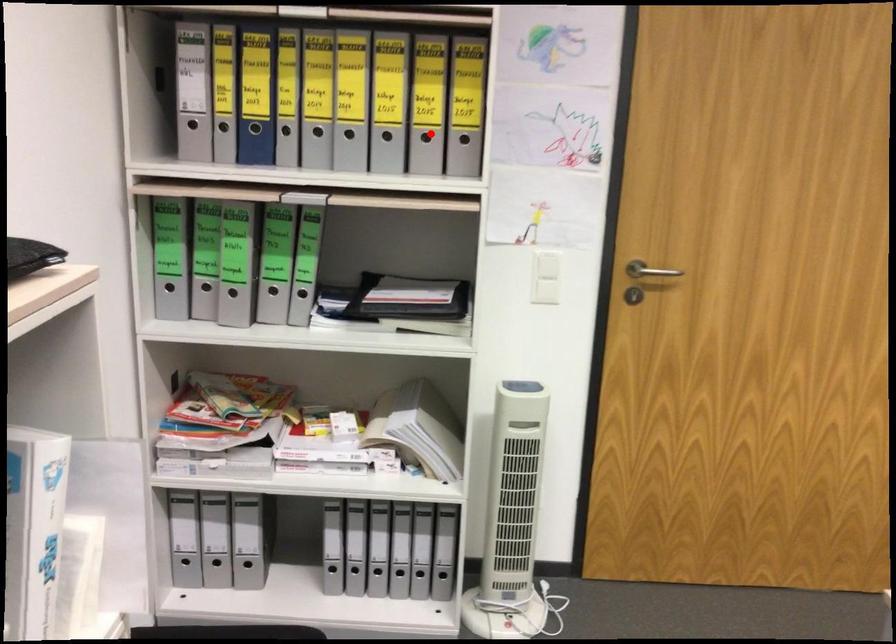
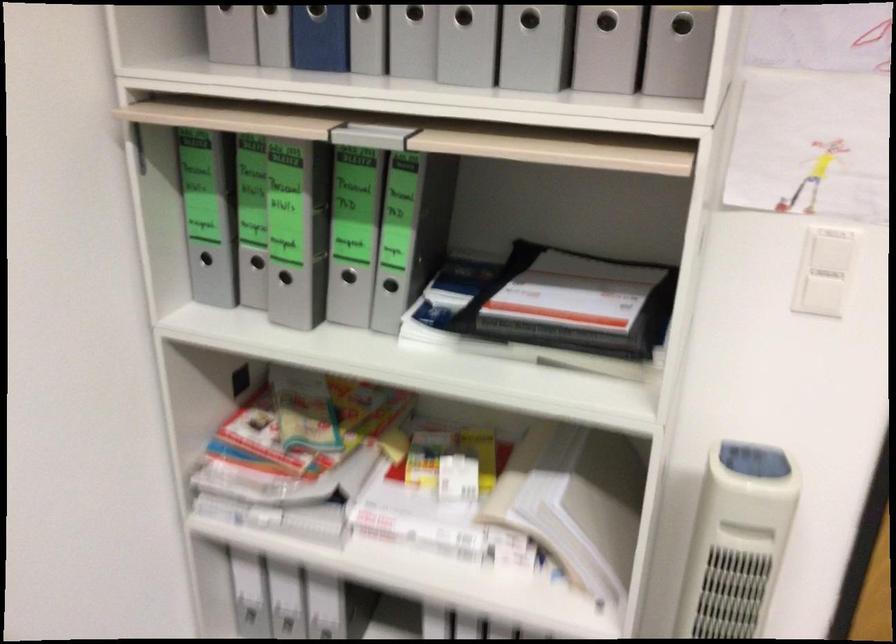
Question: I am providing you with two images of the same scene from different viewpoints. Image1 has a red point marked. In image2, the corresponding 3D location appears at what relative position? Reply with the corresponding letter.

Choices:
 (A) Closer
 (B) Farther

Answer: (A)